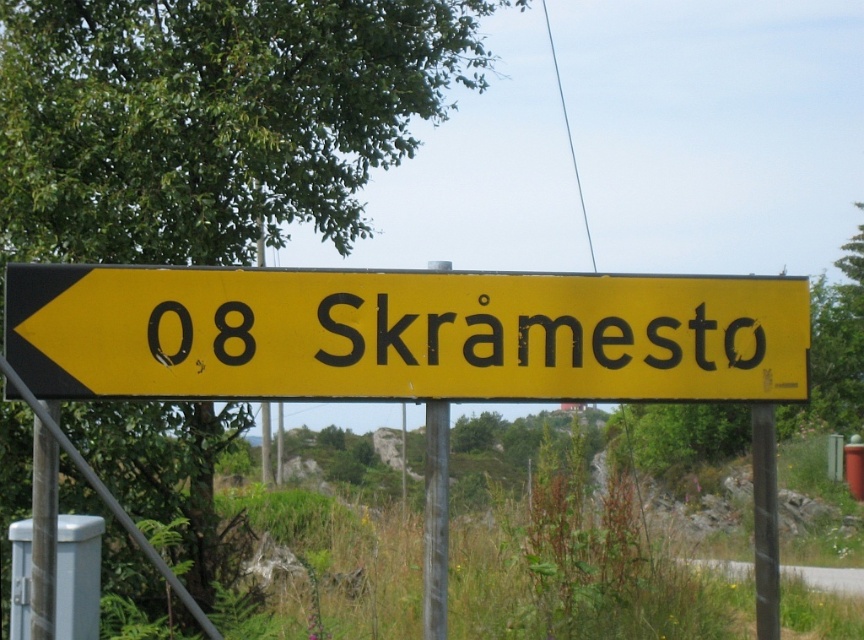
Can you confirm if yellow matte sign at center is positioned below yellow/black text at center?

Yes, yellow matte sign at center is below yellow/black text at center.

Can you confirm if yellow matte sign at center is smaller than yellow/black text at center?

Incorrect, yellow matte sign at center is not smaller in size than yellow/black text at center.

Image resolution: width=864 pixels, height=640 pixels. I want to click on yellow matte sign at center, so click(403, 333).

In order to click on yellow matte sign at center in this screenshot , I will do `click(403, 333)`.